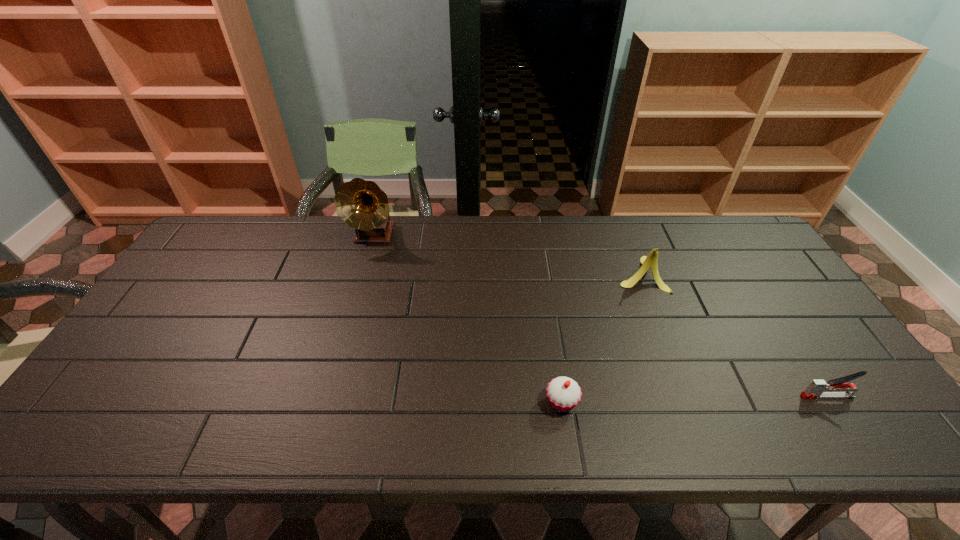
I want to click on blank area located on the handle side of the second shortest object, so click(743, 396).

The height and width of the screenshot is (540, 960). What are the coordinates of `free spot located on the handle side of the second shortest object` in the screenshot? It's located at (675, 396).

Locate an element on the screen. The height and width of the screenshot is (540, 960). vacant region located 0.270m on the handle side of the second shortest object is located at coordinates (688, 396).

This screenshot has height=540, width=960. I want to click on vacant space positioned on the back of the second object from left to right, so click(543, 281).

Locate an element on the screen. This screenshot has height=540, width=960. phonograph_record that is at the far edge is located at coordinates (363, 206).

Where is `banana at the far edge`? banana at the far edge is located at coordinates (651, 261).

What are the coordinates of `object that is at the near edge` in the screenshot? It's located at (563, 393).

Identify the location of object located in the right edge section of the desktop. (817, 388).

Locate an element on the screen. The image size is (960, 540). vacant point at the far edge is located at coordinates (455, 221).

Find the location of a particular element. vacant space at the near edge of the desktop is located at coordinates (622, 411).